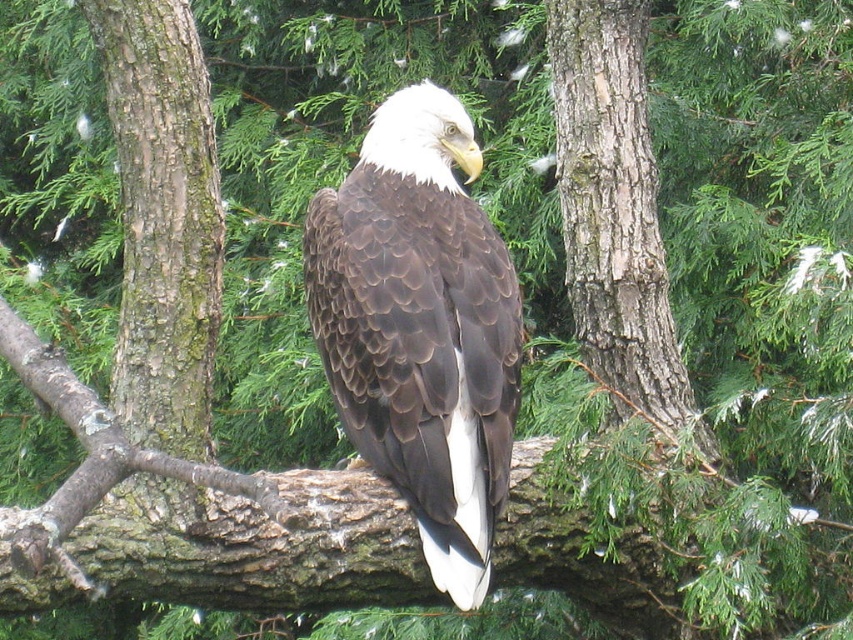
You are an ornithologist observing a bald eagle in its natural habitat. You notice the brown textured feathers at center and the smooth bark tree trunk at center. Which object is taller in the image?

The brown textured feathers at center is shorter than the smooth bark tree trunk at center, so the smooth bark tree trunk at center is taller.